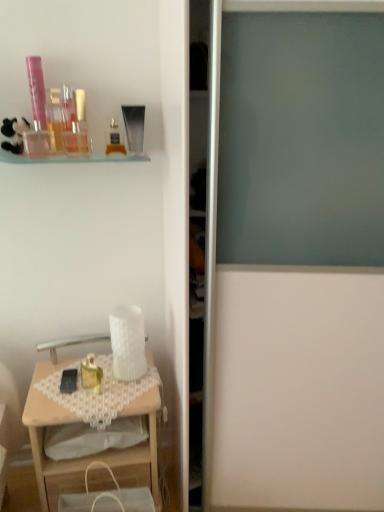
Question: From the image's perspective, is translucent plastic container at upper left, which is the fifth toiletry in top-to-bottom order, located beneath matte plastic perfume bottle at upper left, placed as the seventh toiletry when sorted from top to bottom?

Choices:
 (A) no
 (B) yes

Answer: (A)

Question: Does translucent plastic container at upper left, arranged as the 4th toiletry when ordered from the bottom, have a greater height compared to matte plastic perfume bottle at upper left, the 2th toiletry when ordered from bottom to top?

Choices:
 (A) no
 (B) yes

Answer: (B)

Question: Considering the relative sizes of translucent plastic container at upper left, arranged as the 4th toiletry when ordered from the bottom, and matte plastic perfume bottle at upper left, the 2th toiletry when ordered from bottom to top, in the image provided, is translucent plastic container at upper left, arranged as the 4th toiletry when ordered from the bottom, wider than matte plastic perfume bottle at upper left, the 2th toiletry when ordered from bottom to top,?

Choices:
 (A) no
 (B) yes

Answer: (B)

Question: Is translucent plastic container at upper left, which is the fifth toiletry in top-to-bottom order, bigger than matte plastic perfume bottle at upper left, the 2th toiletry when ordered from bottom to top?

Choices:
 (A) no
 (B) yes

Answer: (B)

Question: Is matte plastic perfume bottle at upper left, the 2th toiletry when ordered from bottom to top, at the back of translucent plastic container at upper left, arranged as the 4th toiletry when ordered from the bottom?

Choices:
 (A) no
 (B) yes

Answer: (A)

Question: Is translucent plastic container at upper left, arranged as the 4th toiletry when ordered from the bottom, far away from matte plastic perfume bottle at upper left, placed as the seventh toiletry when sorted from top to bottom?

Choices:
 (A) yes
 (B) no

Answer: (B)

Question: Can you confirm if translucent glass perfume bottle at upper center, the 6th toiletry positioned from the top, is positioned to the left of black matte mobile phone at lower left?

Choices:
 (A) yes
 (B) no

Answer: (B)

Question: Is translucent glass perfume bottle at upper center, the 6th toiletry positioned from the top, facing away from black matte mobile phone at lower left?

Choices:
 (A) yes
 (B) no

Answer: (B)

Question: From the image's perspective, would you say translucent glass perfume bottle at upper center, the 6th toiletry positioned from the top, is shown under black matte mobile phone at lower left?

Choices:
 (A) yes
 (B) no

Answer: (B)

Question: Can you confirm if translucent glass perfume bottle at upper center, which is counted as the third toiletry, starting from the bottom, is taller than black matte mobile phone at lower left?

Choices:
 (A) no
 (B) yes

Answer: (B)

Question: From the image's perspective, is translucent glass perfume bottle at upper center, the 6th toiletry positioned from the top, located above black matte mobile phone at lower left?

Choices:
 (A) yes
 (B) no

Answer: (A)

Question: Is translucent glass perfume bottle at upper center, which is counted as the third toiletry, starting from the bottom, behind black matte mobile phone at lower left?

Choices:
 (A) yes
 (B) no

Answer: (B)

Question: Is wooden desk at lower left in front of pink plastic tube at upper left, which is the first toiletry in top-to-bottom order?

Choices:
 (A) yes
 (B) no

Answer: (A)